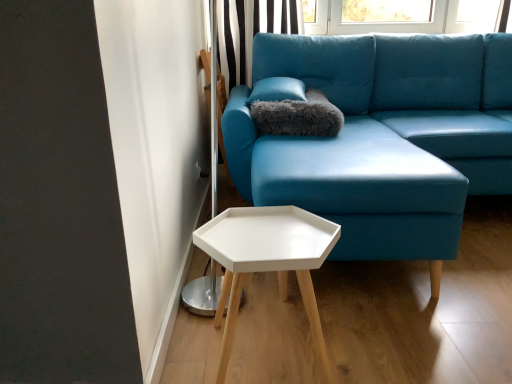
Question: Based on their sizes in the image, would you say white matte hexagonal table at lower center is bigger or smaller than black striped curtain at upper center?

Choices:
 (A) small
 (B) big

Answer: (A)

Question: Is white matte hexagonal table at lower center wider or thinner than black striped curtain at upper center?

Choices:
 (A) thin
 (B) wide

Answer: (B)

Question: Estimate the real-world distances between objects in this image. Which object is farther from the matte blue fabric couch at center?

Choices:
 (A) black striped curtain at upper center
 (B) white matte hexagonal table at lower center
 (C) gray fluffy pillow at upper center

Answer: (A)

Question: Based on their relative distances, which object is nearer to the matte blue fabric couch at center?

Choices:
 (A) white matte hexagonal table at lower center
 (B) black striped curtain at upper center
 (C) gray fluffy pillow at upper center

Answer: (C)